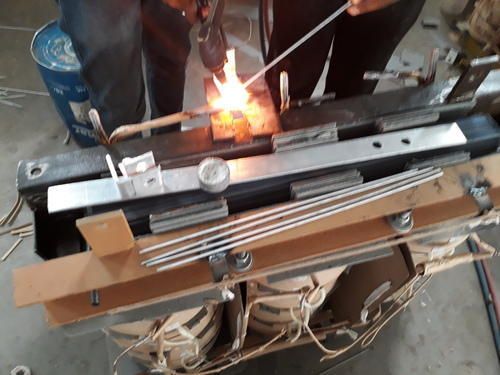
At what (x,y) coordinates should I click in order to perform the action: click on hole in beam. Please return your answer as a coordinate pair (x, y). Looking at the image, I should click on (36, 165).